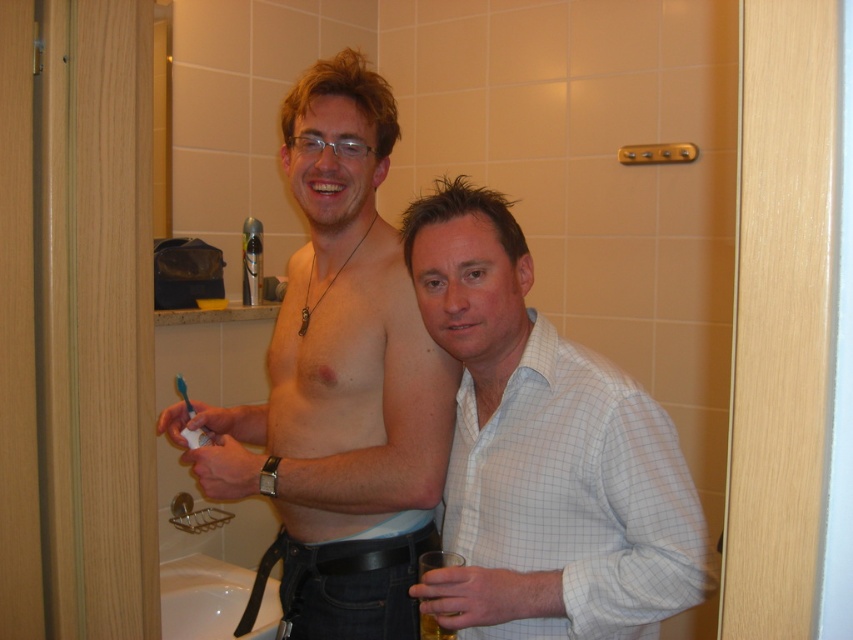
You are a photographer setting up a shoot in the bathroom. You need to position a new lamp so that it illuminates both the white checkered shirt at center and the blue plastic toothbrush at lower left without casting shadows between them. Based on their positions, where should you place the lamp?

The white checkered shirt at center is in front of the blue plastic toothbrush at lower left, so placing the lamp behind the blue plastic toothbrush at lower left would ensure both objects are illuminated without shadows between them.

You are designing a storage box that needs to accommodate both the white checkered shirt at center and the blue plastic toothbrush at lower left. Given their sizes, which item requires a wider storage compartment?

The white checkered shirt at center requires a wider storage compartment because its width is larger than the blue plastic toothbrush at lower left.